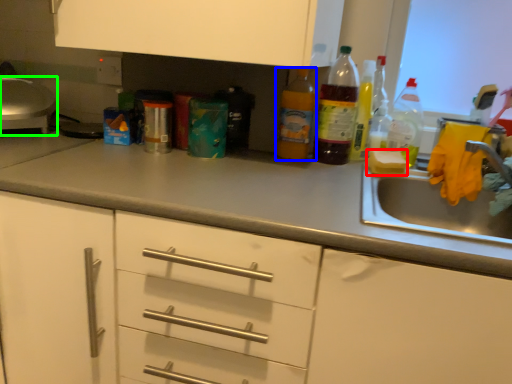
Question: Which object is the farthest from food (highlighted by a red box)? Choose among these: bottle (highlighted by a blue box) or appliance (highlighted by a green box).

Choices:
 (A) bottle
 (B) appliance

Answer: (B)